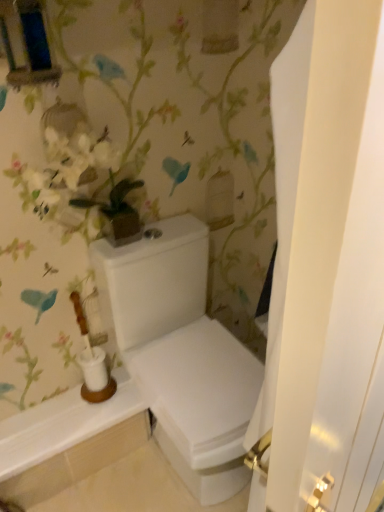
What do you see at coordinates (29, 46) in the screenshot? The height and width of the screenshot is (512, 384). I see `metallic blue medicine cabinet at upper left` at bounding box center [29, 46].

Locate an element on the screen. Image resolution: width=384 pixels, height=512 pixels. metallic blue medicine cabinet at upper left is located at coordinates (29, 46).

The width and height of the screenshot is (384, 512). What are the coordinates of `metallic blue medicine cabinet at upper left` in the screenshot? It's located at (29, 46).